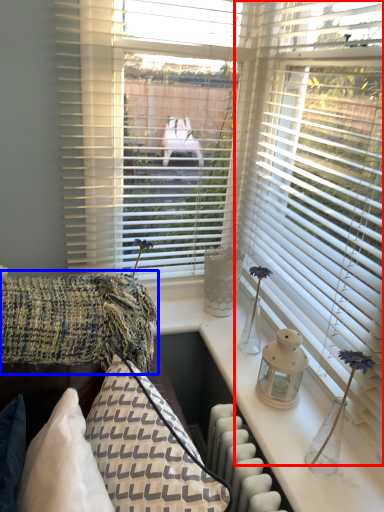
Question: Which of the following is the closest to the observer, window blind (highlighted by a red box) or blanket (highlighted by a blue box)?

Choices:
 (A) window blind
 (B) blanket

Answer: (A)